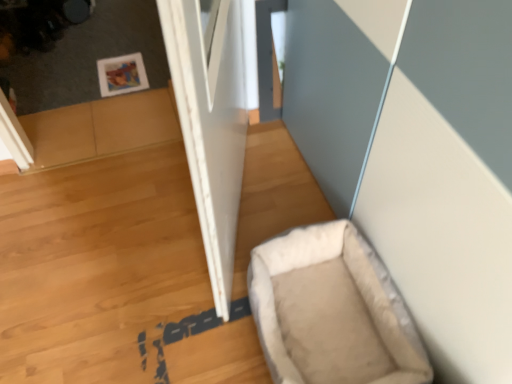
You are a GUI agent. You are given a task and a screenshot of the screen. Output one action in this format:
    pyautogui.click(x=<x>, y=<y>)
    Task: Click on the vacant space that is in between white matte door at center and beige fabric dog bed at lower right
    
    Given the screenshot: What is the action you would take?
    pyautogui.click(x=274, y=227)